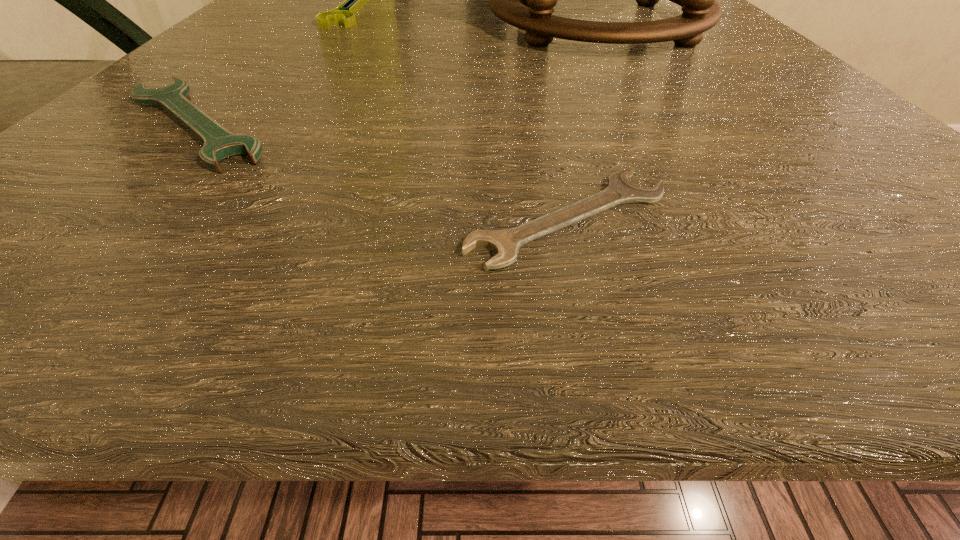
You are a GUI agent. You are given a task and a screenshot of the screen. Output one action in this format:
    pyautogui.click(x=<x>, y=<y>)
    Task: Click on the second farthest wrench
    This screenshot has width=960, height=540.
    Given the screenshot: What is the action you would take?
    pyautogui.click(x=219, y=144)

Locate an element on the screen. This screenshot has width=960, height=540. the shortest wrench is located at coordinates (505, 243).

Identify the location of the rightmost wrench. (505, 243).

Where is `free location located on the back of the second farthest wrench`? free location located on the back of the second farthest wrench is located at coordinates (301, 16).

Image resolution: width=960 pixels, height=540 pixels. I want to click on vacant position located on the back of the shortest object, so click(x=541, y=98).

Identify the location of object that is at the near edge. (505, 243).

The width and height of the screenshot is (960, 540). What are the coordinates of `object present at the left edge` in the screenshot? It's located at click(x=219, y=144).

You are a GUI agent. You are given a task and a screenshot of the screen. Output one action in this format:
    pyautogui.click(x=<x>, y=<y>)
    Task: Click on the blank space at the near edge
    The height and width of the screenshot is (540, 960).
    Given the screenshot: What is the action you would take?
    pyautogui.click(x=204, y=239)

The width and height of the screenshot is (960, 540). Identify the location of free space at the left edge of the desktop. pyautogui.click(x=260, y=68).

In the image, there is a desktop. Where is `vacant space at the right edge`? vacant space at the right edge is located at coordinates (629, 21).